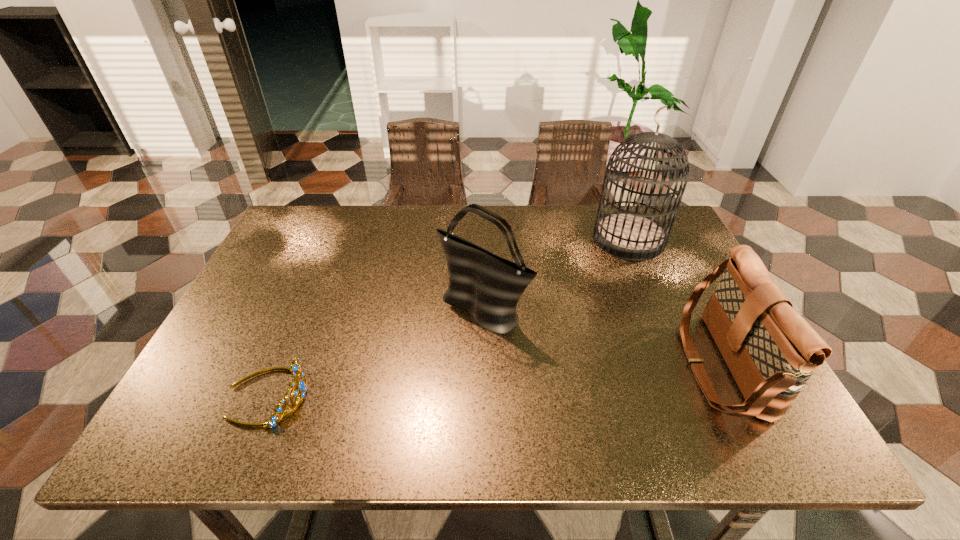
You are a GUI agent. You are given a task and a screenshot of the screen. Output one action in this format:
    pyautogui.click(x=<x>, y=<y>)
    Task: Click on the object at the near left corner
    The width and height of the screenshot is (960, 540).
    Given the screenshot: What is the action you would take?
    pyautogui.click(x=296, y=369)

Find the location of `object that is at the far right corner`. object that is at the far right corner is located at coordinates (628, 235).

Identify the location of object that is positioned at the near right corner. This screenshot has width=960, height=540. (771, 351).

You are a GUI agent. You are given a task and a screenshot of the screen. Output one action in this format:
    pyautogui.click(x=<x>, y=<y>)
    Task: Click on the vacant space at the far edge
    This screenshot has height=540, width=960.
    Given the screenshot: What is the action you would take?
    pyautogui.click(x=540, y=214)

You are a GUI agent. You are given a task and a screenshot of the screen. Output one action in this format:
    pyautogui.click(x=<x>, y=<y>)
    Task: Click on the free space at the near edge of the desktop
    
    Given the screenshot: What is the action you would take?
    pyautogui.click(x=454, y=415)

This screenshot has height=540, width=960. I want to click on blank space at the left edge, so click(x=241, y=320).

Identify the location of blank space at the right edge. The height and width of the screenshot is (540, 960). (647, 271).

Find the location of a particular element. blank space at the near left corner of the desktop is located at coordinates click(x=212, y=416).

Find the location of a particular element. The image size is (960, 540). empty location between the third shortest object and the shorter shoulder bag is located at coordinates (601, 337).

Locate an element on the screen. This screenshot has height=540, width=960. free point between the second shortest object and the shortest object is located at coordinates (493, 380).